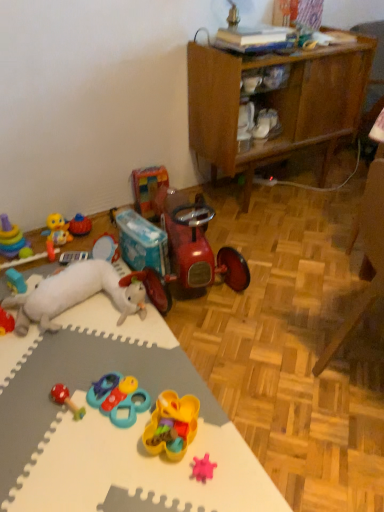
Locate an element on the screen. This screenshot has height=512, width=384. empty space that is in between pink rubber star at lower center, placed as the twelfth toy when sorted from left to right, and white plush toy at upper left, the eighth toy when ordered from right to left is located at coordinates (112, 362).